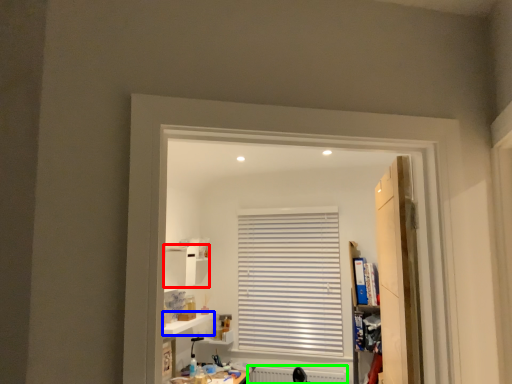
Question: Which is nearer to the cabinet (highlighted by a red box)? window sill (highlighted by a blue box) or radiator (highlighted by a green box).

Choices:
 (A) window sill
 (B) radiator

Answer: (A)